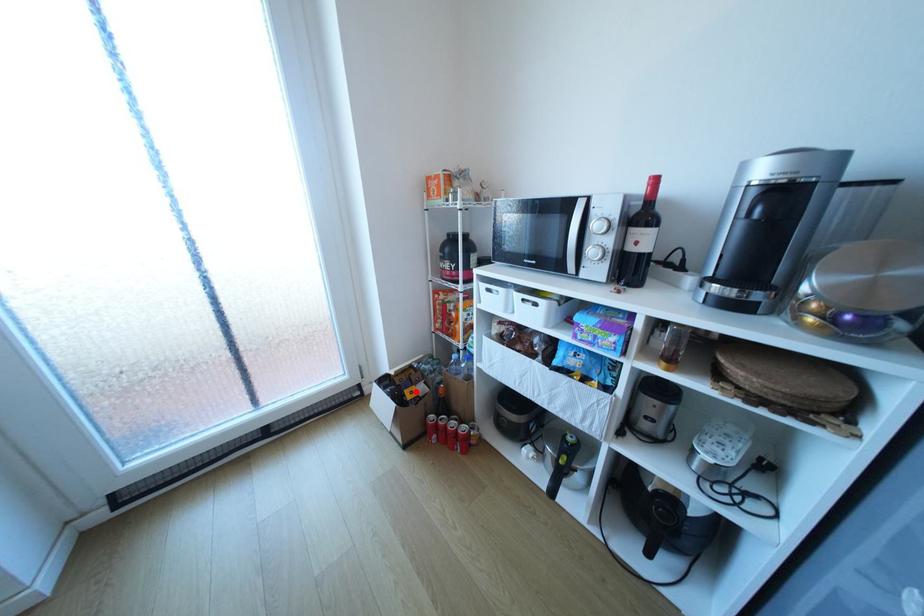
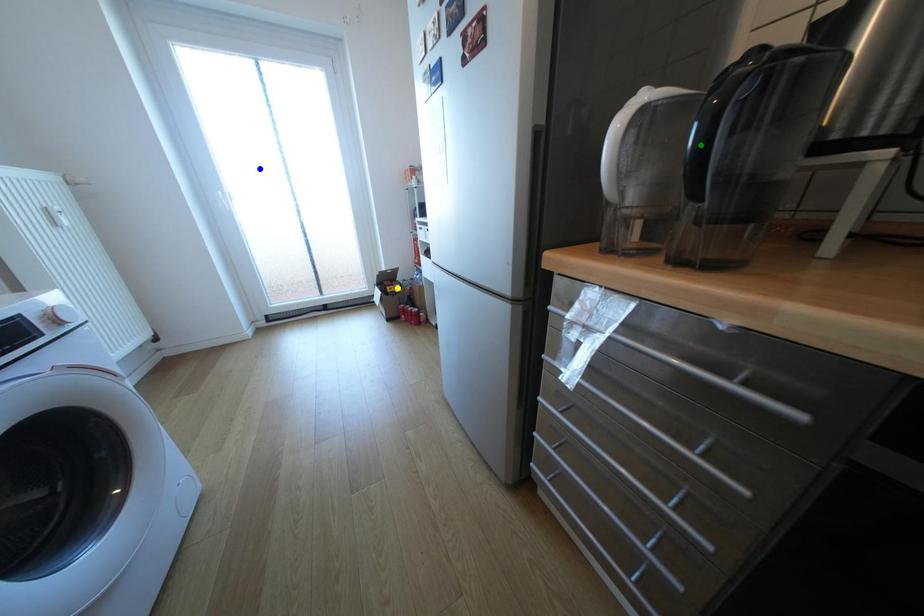
Question: I am providing you with two images of the same scene from different viewpoints. A red point is marked on the first image. You are given multiple points on the second image. Which point in image 2 represents the same 3d spot as the red point in image 1?

Choices:
 (A) blue point
 (B) green point
 (C) yellow point

Answer: (C)